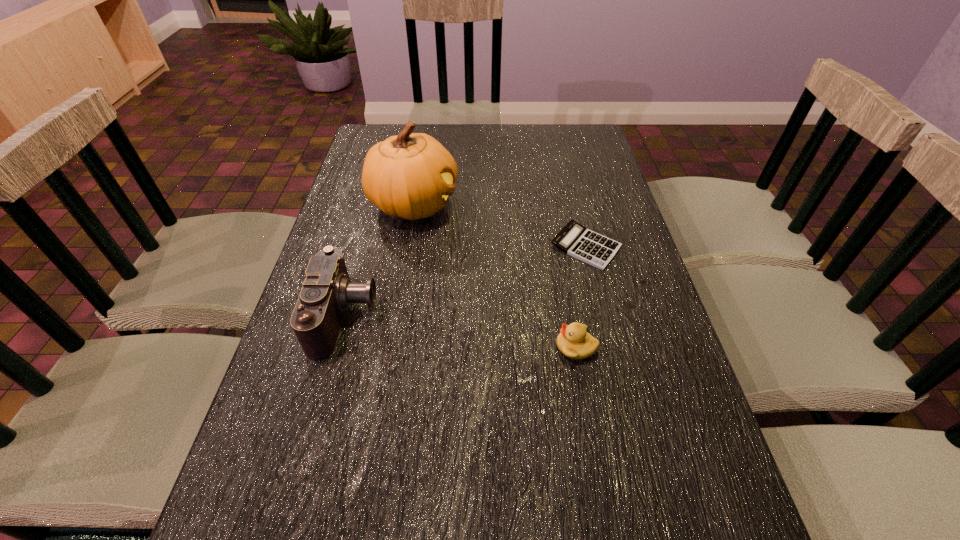
The width and height of the screenshot is (960, 540). I want to click on vacant space that satisfies the following two spatial constraints: 1. on the front face of the pumpkin; 2. on the right side of the shortest object, so click(406, 246).

What are the coordinates of `free space that satisfies the following two spatial constraints: 1. on the front face of the calculator; 2. on the left side of the tallest object` in the screenshot? It's located at (406, 246).

This screenshot has width=960, height=540. I want to click on vacant space that satisfies the following two spatial constraints: 1. on the front face of the tallest object; 2. on the right side of the calculator, so click(406, 246).

Identify the location of vacant space that satisfies the following two spatial constraints: 1. on the front face of the pumpkin; 2. on the right side of the shortest object. (406, 246).

Image resolution: width=960 pixels, height=540 pixels. I want to click on vacant space that satisfies the following two spatial constraints: 1. on the front face of the tallest object; 2. on the left side of the calculator, so click(406, 246).

I want to click on vacant area in the image that satisfies the following two spatial constraints: 1. on the front side of the calculator; 2. on the front-facing side of the second shortest object, so click(x=611, y=347).